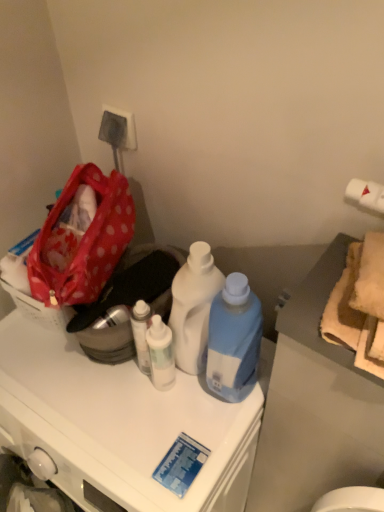
Where is `free space in front of white glossy bottle at center, which ranks as the 1th bottle in left-to-right order`? This screenshot has width=384, height=512. free space in front of white glossy bottle at center, which ranks as the 1th bottle in left-to-right order is located at coordinates (158, 444).